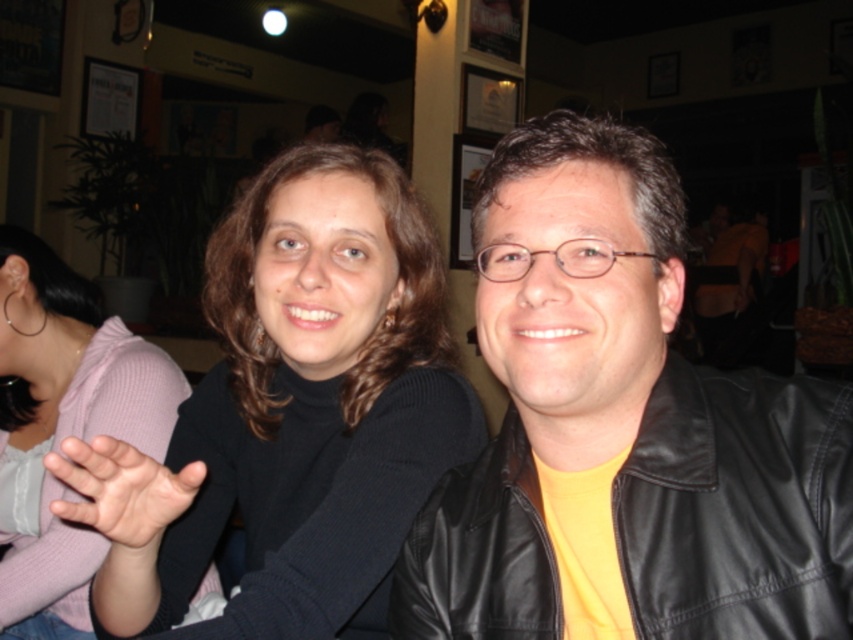
You are a photographer adjusting the lighting in the scene. You need to ensure both the black turtleneck sweater at center and the matte black sweater at center are evenly illuminated. Given their sizes, which sweater requires a wider light spread to cover its entire surface?

The black turtleneck sweater at center requires a wider light spread because its width surpasses that of the matte black sweater at center.

You are a fashion designer observing two sweaters in the image. The black turtleneck sweater at center and the matte black sweater at center. Which one has a longer length?

The matte black sweater at center is longer than the black turtleneck sweater at center.

You are a photographer trying to capture the perfect shot of the black leather jacket at right. According to the coordinates provided, where should you position your camera to ensure the jacket is centered in the frame?

The black leather jacket at right is located at coordinates point (738, 506), so to center it in the frame, position your camera so the jacket aligns with the center point of your viewfinder at those coordinates.